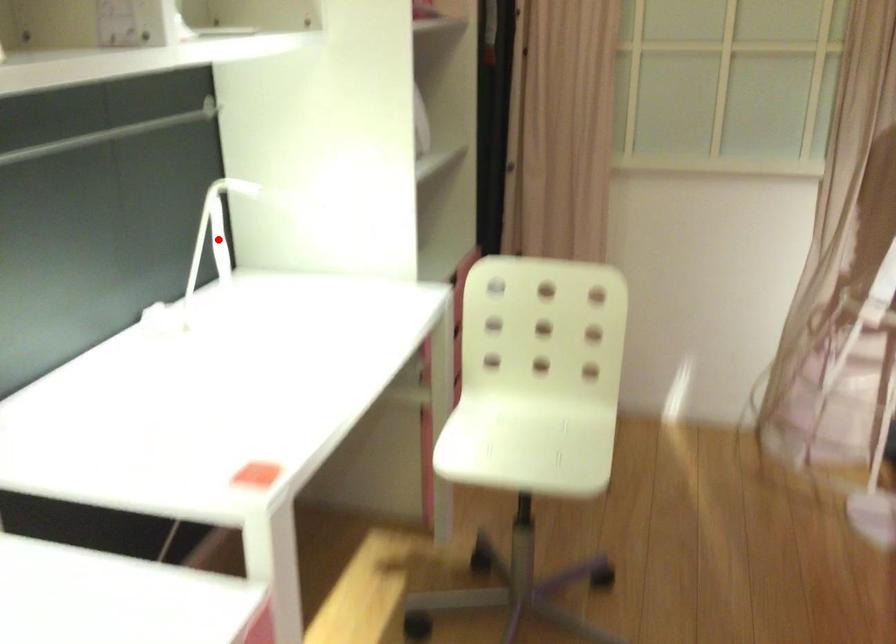
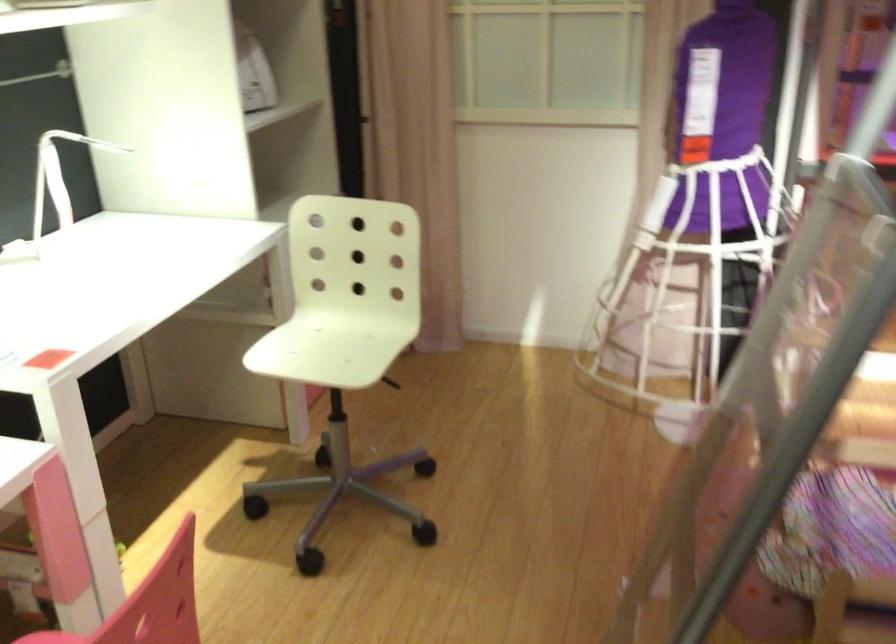
Question: I am providing you with two images of the same scene from different viewpoints. A red point is shown in image1. For the corresponding object point in image2, is it positioned nearer or farther from the camera?

Choices:
 (A) Nearer
 (B) Farther

Answer: (B)